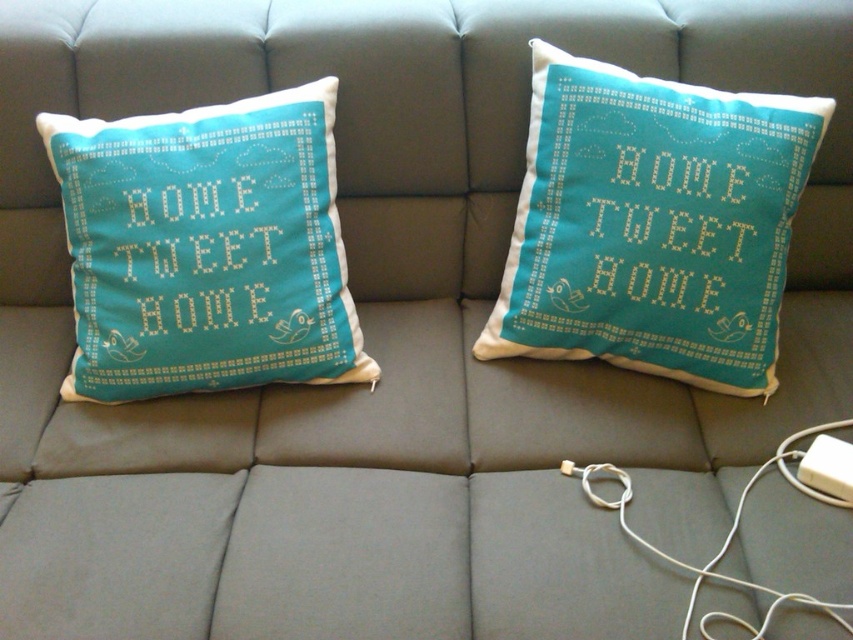
Question: Which object is closer to the camera taking this photo?

Choices:
 (A) teal cross-stitch pillow at upper right
 (B) white plastic charger at lower right
 (C) teal cross-stitch pillow at left

Answer: (B)

Question: Estimate the real-world distances between objects in this image. Which object is farther from the white plastic charger at lower right?

Choices:
 (A) teal cross-stitch pillow at left
 (B) teal cross-stitch pillow at upper right

Answer: (A)

Question: Is teal cross-stitch pillow at upper right wider than teal cross-stitch pillow at left?

Choices:
 (A) no
 (B) yes

Answer: (A)

Question: Is teal cross-stitch pillow at upper right positioned in front of white plastic charger at lower right?

Choices:
 (A) no
 (B) yes

Answer: (A)

Question: Is teal cross-stitch pillow at upper right further to the viewer compared to white plastic charger at lower right?

Choices:
 (A) no
 (B) yes

Answer: (B)

Question: Which point is farther to the camera?

Choices:
 (A) (595, 256)
 (B) (730, 620)

Answer: (A)